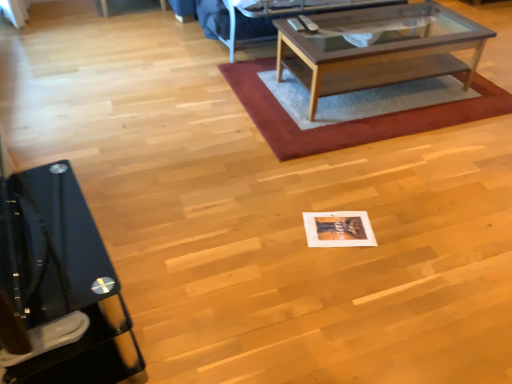
Question: Does rug with woven texture at center lie in front of black glossy desk at left?

Choices:
 (A) yes
 (B) no

Answer: (B)

Question: Would you say rug with woven texture at center is outside black glossy desk at left?

Choices:
 (A) yes
 (B) no

Answer: (A)

Question: Does rug with woven texture at center have a lesser width compared to black glossy desk at left?

Choices:
 (A) yes
 (B) no

Answer: (B)

Question: Is rug with woven texture at center next to black glossy desk at left and touching it?

Choices:
 (A) no
 (B) yes

Answer: (A)

Question: From the image's perspective, is rug with woven texture at center located above black glossy desk at left?

Choices:
 (A) yes
 (B) no

Answer: (A)

Question: Is point click(x=250, y=117) closer or farther from the camera than point click(x=388, y=31)?

Choices:
 (A) farther
 (B) closer

Answer: (B)

Question: Is rug with woven texture at center in front of or behind wooden glass coffee table at center in the image?

Choices:
 (A) behind
 (B) front

Answer: (A)

Question: Considering the positions of rug with woven texture at center and wooden glass coffee table at center in the image, is rug with woven texture at center wider or thinner than wooden glass coffee table at center?

Choices:
 (A) thin
 (B) wide

Answer: (B)

Question: Looking at the image, does rug with woven texture at center seem bigger or smaller compared to wooden glass coffee table at center?

Choices:
 (A) big
 (B) small

Answer: (B)

Question: Would you say black glossy desk at left is to the left or to the right of rug with woven texture at center in the picture?

Choices:
 (A) left
 (B) right

Answer: (A)

Question: Relative to rug with woven texture at center, is black glossy desk at left in front or behind?

Choices:
 (A) front
 (B) behind

Answer: (A)

Question: Does point (35, 365) appear closer or farther from the camera than point (309, 147)?

Choices:
 (A) farther
 (B) closer

Answer: (B)

Question: Is black glossy desk at left inside or outside of rug with woven texture at center?

Choices:
 (A) inside
 (B) outside

Answer: (B)

Question: Is rug with woven texture at center taller or shorter than black glossy desk at left?

Choices:
 (A) short
 (B) tall

Answer: (A)

Question: Looking at their shapes, would you say rug with woven texture at center is wider or thinner than black glossy desk at left?

Choices:
 (A) wide
 (B) thin

Answer: (A)